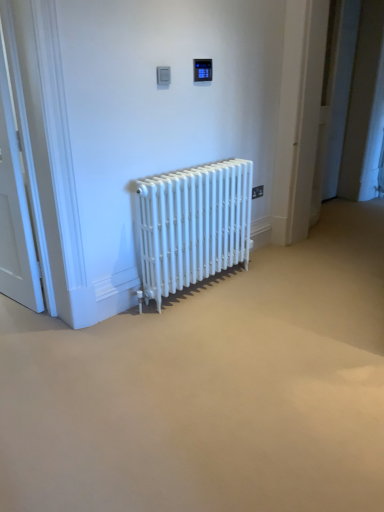
What do you see at coordinates (257, 191) in the screenshot? I see `black plastic electric outlet at upper center` at bounding box center [257, 191].

Image resolution: width=384 pixels, height=512 pixels. What do you see at coordinates (193, 225) in the screenshot?
I see `white matte radiator at center` at bounding box center [193, 225].

The image size is (384, 512). In order to click on black plastic electric outlet at upper center in this screenshot , I will do `click(257, 191)`.

Measure the distance from black plastic electric outlet at upper center to white wooden door at left.

The distance of black plastic electric outlet at upper center from white wooden door at left is 5.76 feet.

Considering the positions of objects black plastic electric outlet at upper center and white wooden door at left in the image provided, who is more to the right, black plastic electric outlet at upper center or white wooden door at left?

→ black plastic electric outlet at upper center.

Does black plastic electric outlet at upper center touch white wooden door at left?

No, black plastic electric outlet at upper center is not next to white wooden door at left.

Can white wooden door at left be found inside black plastic electric outlet at upper center?

No.

Relative to white matte radiator at center, is white wooden door at left in front or behind?

Visually, white wooden door at left is located in front of white matte radiator at center.

From a real-world perspective, which object rests below the other?

In real-world perspective, white matte radiator at center is lower.

Can you confirm if white wooden door at left is taller than white matte radiator at center?

Indeed, white wooden door at left has a greater height compared to white matte radiator at center.

Does white wooden door at left have a greater width compared to white matte radiator at center?

Incorrect, the width of white wooden door at left does not surpass that of white matte radiator at center.

In the scene shown: Which object is closer to the camera taking this photo, black plastic electric outlet at upper center or white matte radiator at center?

white matte radiator at center is more forward.

From the image's perspective, who appears lower, black plastic electric outlet at upper center or white matte radiator at center?

white matte radiator at center is shown below in the image.

Which is more to the right, black plastic electric outlet at upper center or white matte radiator at center?

black plastic electric outlet at upper center is more to the right.

Based on their sizes in the image, would you say black plastic electric outlet at upper center is bigger or smaller than white matte radiator at center?

In the image, black plastic electric outlet at upper center appears to be smaller than white matte radiator at center.

Between white matte radiator at center and black plastic electric outlet at upper center, which one has smaller size?

Smaller between the two is black plastic electric outlet at upper center.

Which is closer to the camera, (160,242) or (255,187)?

Point (160,242)

Do you think white matte radiator at center is within black plastic electric outlet at upper center, or outside of it?

white matte radiator at center is spatially situated outside black plastic electric outlet at upper center.

Based on their positions, is white wooden door at left located to the left or right of black plastic electric outlet at upper center?

white wooden door at left is positioned on black plastic electric outlet at upper center's left side.

Based on the photo, between white wooden door at left and black plastic electric outlet at upper center, which one is positioned behind?

black plastic electric outlet at upper center is more distant.

Between white wooden door at left and black plastic electric outlet at upper center, which one has smaller size?

Smaller between the two is black plastic electric outlet at upper center.

How different are the orientations of white wooden door at left and black plastic electric outlet at upper center in degrees?

The angular difference between white wooden door at left and black plastic electric outlet at upper center is 83.8 degrees.

Can white wooden door at left be found inside white matte radiator at center?

No.

Is point (137, 196) positioned in front of point (18, 208)?

No, (137, 196) is behind (18, 208).

Locate an element on the screen. The width and height of the screenshot is (384, 512). electric outlet that appears above the white wooden door at left (from the image's perspective) is located at coordinates (257, 191).

Identify the location of radiator that is on the right side of white wooden door at left. (193, 225).

Looking at the image, which one is located closer to black plastic electric outlet at upper center, white wooden door at left or white matte radiator at center?

white matte radiator at center is positioned closer to the anchor black plastic electric outlet at upper center.

Which object lies further to the anchor point white wooden door at left, black plastic electric outlet at upper center or white matte radiator at center?

Based on the image, black plastic electric outlet at upper center appears to be further to white wooden door at left.

From the image, which object appears to be nearer to white wooden door at left, white matte radiator at center or black plastic electric outlet at upper center?

Based on the image, white matte radiator at center appears to be nearer to white wooden door at left.

From the image, which object appears to be farther from white matte radiator at center, black plastic electric outlet at upper center or white wooden door at left?

The object further to white matte radiator at center is white wooden door at left.

Looking at the image, which one is located further to black plastic electric outlet at upper center, white matte radiator at center or white wooden door at left?

white wooden door at left is further to black plastic electric outlet at upper center.

Considering their positions, is white wooden door at left positioned further to white matte radiator at center than black plastic electric outlet at upper center?

white wooden door at left is further to white matte radiator at center.

Locate an element on the screen. Image resolution: width=384 pixels, height=512 pixels. radiator located between white wooden door at left and black plastic electric outlet at upper center in the left-right direction is located at coordinates (193, 225).